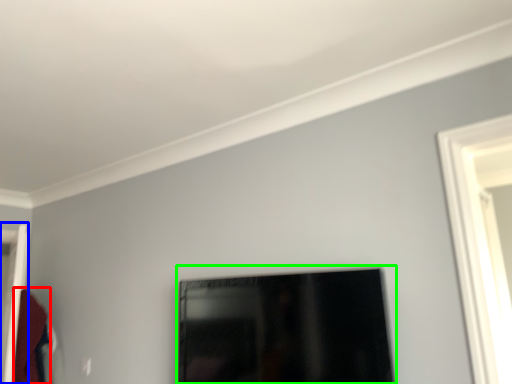
Question: Estimate the real-world distances between objects in this image. Which object is farther from robe (highlighted by a red box), door (highlighted by a blue box) or picture frame (highlighted by a green box)?

Choices:
 (A) door
 (B) picture frame

Answer: (B)